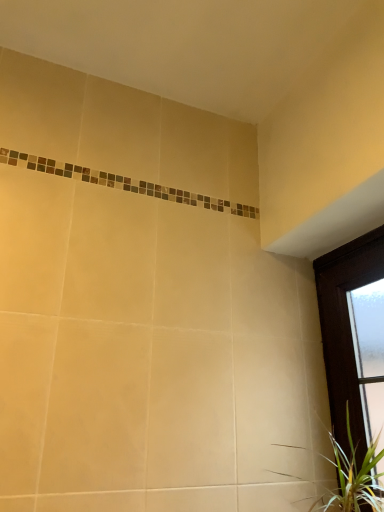
Question: Is green leafy plant at lower right shorter than dark wood window at right?

Choices:
 (A) no
 (B) yes

Answer: (B)

Question: Does green leafy plant at lower right lie behind dark wood window at right?

Choices:
 (A) no
 (B) yes

Answer: (A)

Question: Is green leafy plant at lower right not within dark wood window at right?

Choices:
 (A) no
 (B) yes

Answer: (A)

Question: Does green leafy plant at lower right have a lesser width compared to dark wood window at right?

Choices:
 (A) no
 (B) yes

Answer: (A)

Question: Can you confirm if green leafy plant at lower right is taller than dark wood window at right?

Choices:
 (A) no
 (B) yes

Answer: (A)

Question: Is dark wood window at right at the back of green leafy plant at lower right?

Choices:
 (A) no
 (B) yes

Answer: (B)

Question: From the image's perspective, is dark wood window at right located above green leafy plant at lower right?

Choices:
 (A) yes
 (B) no

Answer: (A)

Question: Does dark wood window at right have a smaller size compared to green leafy plant at lower right?

Choices:
 (A) yes
 (B) no

Answer: (B)

Question: Is dark wood window at right shorter than green leafy plant at lower right?

Choices:
 (A) yes
 (B) no

Answer: (B)

Question: Does dark wood window at right lie in front of green leafy plant at lower right?

Choices:
 (A) yes
 (B) no

Answer: (B)

Question: From a real-world perspective, is dark wood window at right below green leafy plant at lower right?

Choices:
 (A) yes
 (B) no

Answer: (B)

Question: Does dark wood window at right appear on the right side of green leafy plant at lower right?

Choices:
 (A) yes
 (B) no

Answer: (A)

Question: Considering the positions of point (319, 284) and point (342, 484), is point (319, 284) closer or farther from the camera than point (342, 484)?

Choices:
 (A) farther
 (B) closer

Answer: (A)